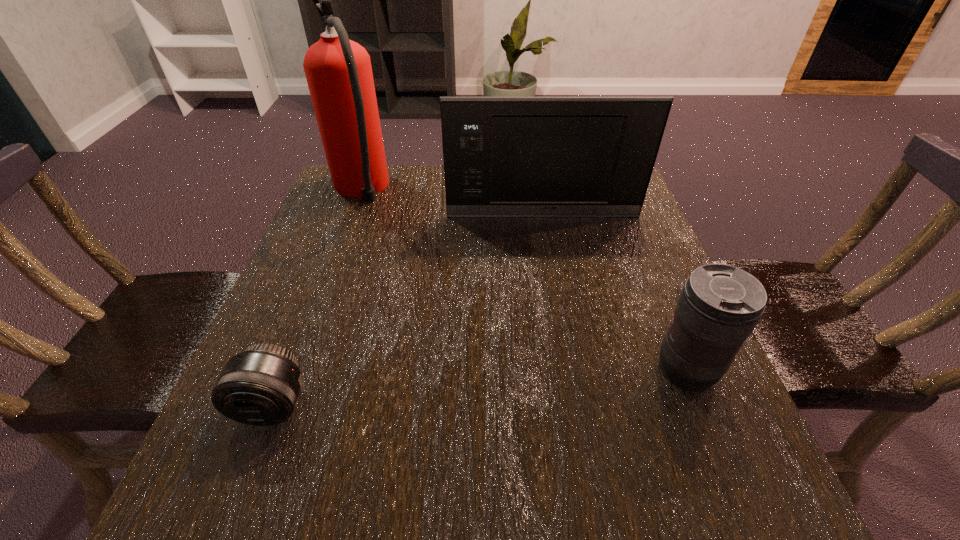
Where is `blank space at the near edge of the desktop`? blank space at the near edge of the desktop is located at coordinates (343, 506).

Where is `vacant space at the left edge of the desktop`? vacant space at the left edge of the desktop is located at coordinates (294, 266).

In the image, there is a desktop. Find the location of `vacant region at the right edge`. vacant region at the right edge is located at coordinates (646, 377).

The height and width of the screenshot is (540, 960). Find the location of `vacant space at the far left corner`. vacant space at the far left corner is located at coordinates (336, 198).

Locate an element on the screen. free space between the right telephoto lens and the shorter telephoto lens is located at coordinates [479, 387].

Image resolution: width=960 pixels, height=540 pixels. I want to click on vacant space that is in between the shortest object and the tallest object, so click(x=317, y=298).

Locate an element on the screen. unoccupied position between the shorter telephoto lens and the fire extinguisher is located at coordinates (317, 298).

This screenshot has width=960, height=540. I want to click on free space between the tallest object and the shorter telephoto lens, so [x=317, y=298].

What are the coordinates of `empty location between the shortest object and the fire extinguisher` in the screenshot? It's located at (317, 298).

This screenshot has width=960, height=540. I want to click on free space between the right telephoto lens and the fire extinguisher, so click(x=523, y=280).